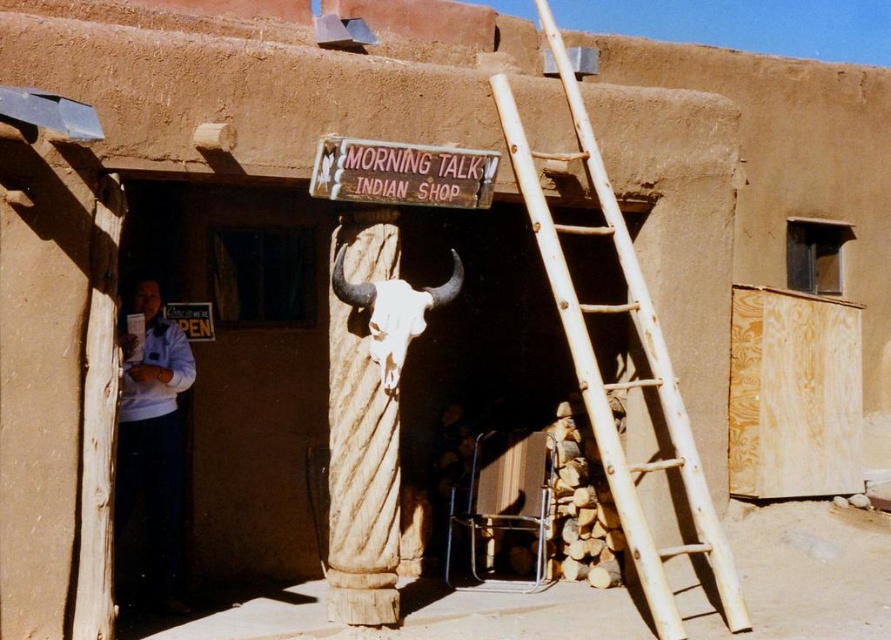
Which is more to the right, natural wood ladder at right or white cotton shirt at left?

natural wood ladder at right is more to the right.

Is point (674, 381) behind point (185, 356)?

That is False.

Where is `natural wood ladder at right`? This screenshot has height=640, width=891. natural wood ladder at right is located at coordinates (597, 362).

Does wooden sign at center have a greater width compared to white bone skull at center?

Yes.

Which is more to the left, wooden sign at center or white bone skull at center?

white bone skull at center

Where is `wooden sign at center`? The height and width of the screenshot is (640, 891). wooden sign at center is located at coordinates [402, 173].

Does natural wood ladder at right have a lesser height compared to wooden sign at center?

No.

Does natural wood ladder at right have a larger size compared to wooden sign at center?

Indeed, natural wood ladder at right has a larger size compared to wooden sign at center.

Who is more forward, (687, 502) or (432, 152)?

Point (432, 152) is more forward.

Identify the location of natural wood ladder at right. (597, 362).